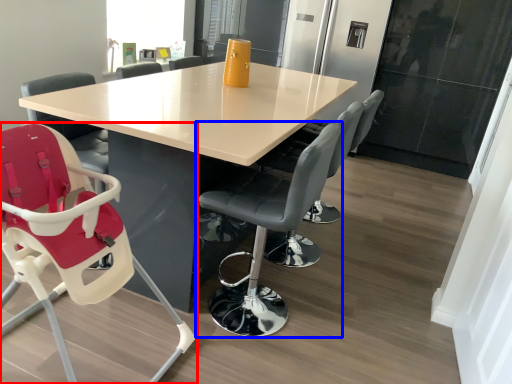
Question: Among these objects, which one is farthest to the camera, chair (highlighted by a red box) or chair (highlighted by a blue box)?

Choices:
 (A) chair
 (B) chair

Answer: (B)